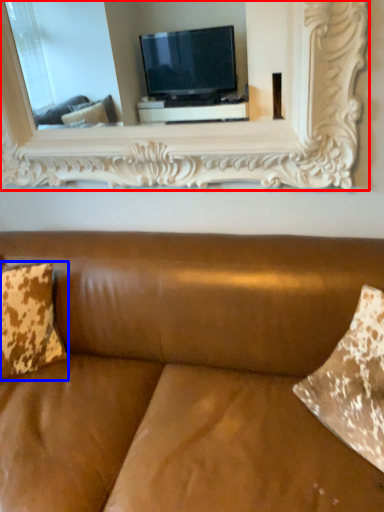
Question: Which point is closer to the camera, picture frame (highlighted by a red box) or pillow (highlighted by a blue box)?

Choices:
 (A) picture frame
 (B) pillow

Answer: (A)